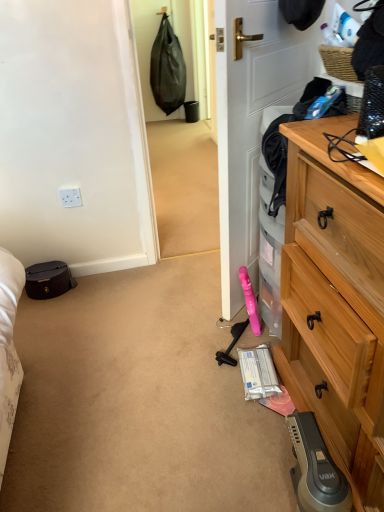
The height and width of the screenshot is (512, 384). Identify the location of free space between wooden chest of drawers at right and matte black suitcase at left. (155, 356).